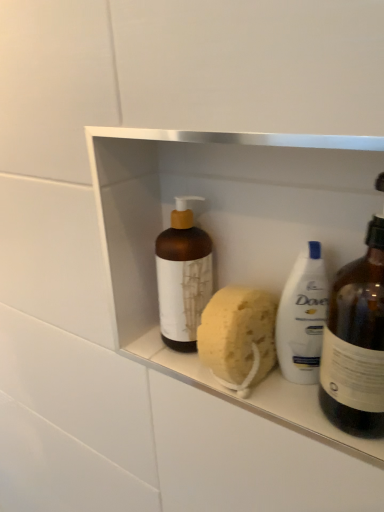
Question: Is the depth of yellow sponge at center less than that of brown matte bottle at center, which is the second bottle from right to left?

Choices:
 (A) no
 (B) yes

Answer: (B)

Question: Is yellow sponge at center wider than brown matte bottle at center, which is the second bottle from right to left?

Choices:
 (A) no
 (B) yes

Answer: (B)

Question: Does yellow sponge at center have a lesser height compared to brown matte bottle at center, the 1th bottle from the left?

Choices:
 (A) yes
 (B) no

Answer: (A)

Question: From the image's perspective, is yellow sponge at center located beneath brown matte bottle at center, the 1th bottle from the left?

Choices:
 (A) no
 (B) yes

Answer: (B)

Question: Is yellow sponge at center touching brown matte bottle at center, the 1th bottle from the left?

Choices:
 (A) yes
 (B) no

Answer: (A)

Question: Considering the positions of matte brown bottle at right, which ranks as the second bottle in left-to-right order, and brown matte bottle at center, which is the second bottle from right to left, in the image, is matte brown bottle at right, which ranks as the second bottle in left-to-right order, taller or shorter than brown matte bottle at center, which is the second bottle from right to left,?

Choices:
 (A) short
 (B) tall

Answer: (B)

Question: Is point (357, 378) positioned closer to the camera than point (173, 261)?

Choices:
 (A) farther
 (B) closer

Answer: (B)

Question: From the image's perspective, relative to brown matte bottle at center, which is the second bottle from right to left, is matte brown bottle at right, which ranks as the second bottle in left-to-right order, above or below?

Choices:
 (A) above
 (B) below

Answer: (B)

Question: In terms of width, does matte brown bottle at right, which ranks as the second bottle in left-to-right order, look wider or thinner when compared to brown matte bottle at center, the 1th bottle from the left?

Choices:
 (A) thin
 (B) wide

Answer: (B)

Question: Does point (193, 271) appear closer or farther from the camera than point (205, 339)?

Choices:
 (A) closer
 (B) farther

Answer: (B)

Question: Do you think brown matte bottle at center, the 1th bottle from the left, is within yellow sponge at center, or outside of it?

Choices:
 (A) outside
 (B) inside

Answer: (A)

Question: Relative to yellow sponge at center, is brown matte bottle at center, the 1th bottle from the left, in front or behind?

Choices:
 (A) front
 (B) behind

Answer: (B)

Question: Is brown matte bottle at center, which is the second bottle from right to left, taller or shorter than yellow sponge at center?

Choices:
 (A) short
 (B) tall

Answer: (B)

Question: Considering the positions of yellow sponge at center and brown matte bottle at center, which is the second bottle from right to left, in the image, is yellow sponge at center wider or thinner than brown matte bottle at center, which is the second bottle from right to left,?

Choices:
 (A) thin
 (B) wide

Answer: (B)

Question: Would you say yellow sponge at center is inside or outside brown matte bottle at center, the 1th bottle from the left?

Choices:
 (A) inside
 (B) outside

Answer: (B)